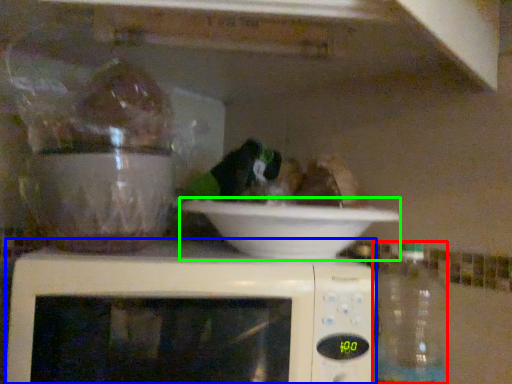
Question: Which object is positioned farthest from bottle (highlighted by a red box)? Select from microwave oven (highlighted by a blue box) and bowl (highlighted by a green box).

Choices:
 (A) microwave oven
 (B) bowl

Answer: (A)